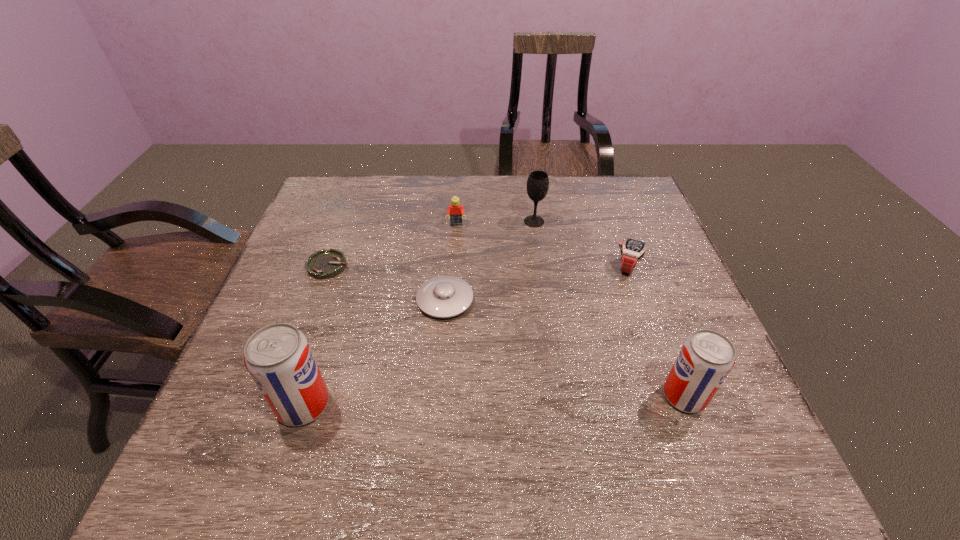
The height and width of the screenshot is (540, 960). I want to click on blank region between the third object from right to left and the saucer, so click(x=490, y=261).

Find the location of `unoccupied area between the third nearest object and the third shortest object`. unoccupied area between the third nearest object and the third shortest object is located at coordinates 537,284.

Find the location of a particular element. Image resolution: width=960 pixels, height=540 pixels. free area in between the third nearest object and the watch is located at coordinates (537, 284).

This screenshot has height=540, width=960. In order to click on free space between the fourth shortest object and the third shortest object in this screenshot , I will do `click(542, 246)`.

Locate an element on the screen. The width and height of the screenshot is (960, 540). vacant space that's between the third nearest object and the ashtray is located at coordinates (387, 283).

The image size is (960, 540). I want to click on vacant space in between the watch and the shortest object, so click(478, 266).

This screenshot has height=540, width=960. What are the coordinates of `vacant region between the third object from right to left and the right soda` in the screenshot? It's located at (610, 309).

Image resolution: width=960 pixels, height=540 pixels. Find the location of `free space between the wineglass and the second shortest object`. free space between the wineglass and the second shortest object is located at coordinates (490, 261).

Find the location of `free spot between the ashtray and the Lego`. free spot between the ashtray and the Lego is located at coordinates (393, 245).

At what (x,y) coordinates should I click in order to perform the action: click on unoccupied position between the tallest object and the Lego. Please return your answer as a coordinate pair (x, y). Looking at the image, I should click on (380, 314).